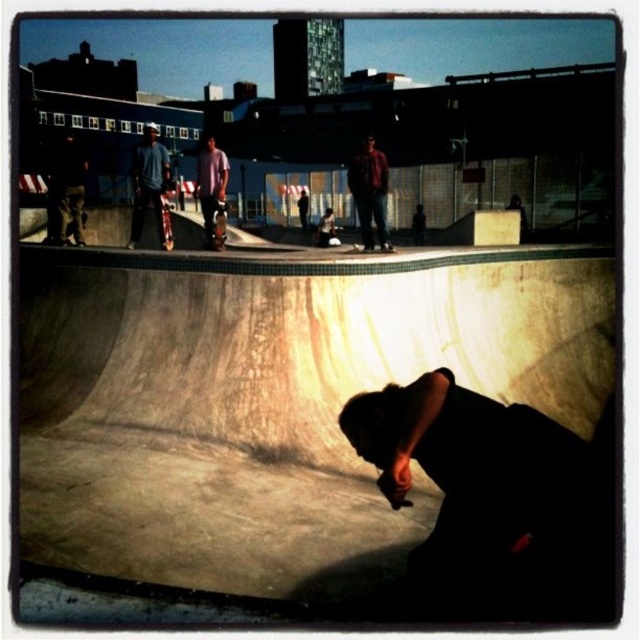
Can you confirm if smooth concrete bowl at center is wider than light purple shirt at upper center?

Yes.

Does smooth concrete bowl at center come behind light purple shirt at upper center?

No.

Which is in front, point (108, 557) or point (212, 225)?

Point (108, 557) is in front.

Find the location of a particular element. This screenshot has width=640, height=640. smooth concrete bowl at center is located at coordinates (321, 428).

In order to click on smooth concrete bowl at center in this screenshot , I will do `click(321, 428)`.

Can you confirm if dark brown pants at left is positioned above light purple shirt at upper center?

Indeed, dark brown pants at left is positioned over light purple shirt at upper center.

Is point (60, 220) positioned behind point (204, 195)?

That is False.

Is point (64, 225) positioned after point (214, 244)?

No, it is not.

This screenshot has width=640, height=640. I want to click on dark brown pants at left, so click(65, 193).